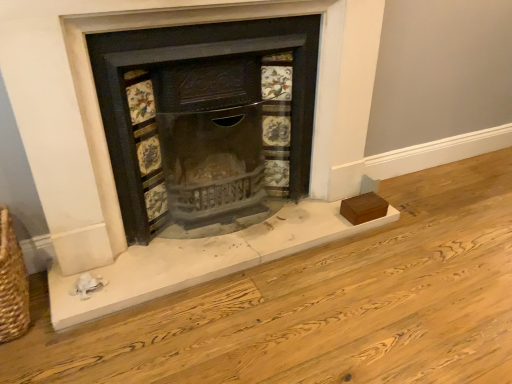
The height and width of the screenshot is (384, 512). Describe the element at coordinates (197, 95) in the screenshot. I see `black cast iron fireplace at center` at that location.

You are a GUI agent. You are given a task and a screenshot of the screen. Output one action in this format:
    pyautogui.click(x=<x>, y=<y>)
    Task: Click on the black cast iron fireplace at center
    This screenshot has height=384, width=512.
    Given the screenshot: What is the action you would take?
    pyautogui.click(x=197, y=95)

Locate an element on the screen. The image size is (512, 384). black cast iron fireplace at center is located at coordinates (197, 95).